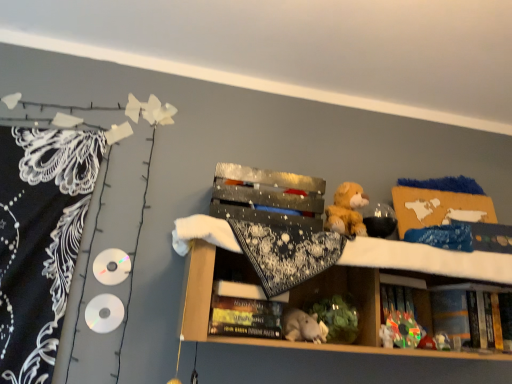
Question: Is shiny metallic box at center inside the boundaries of plush toy at center, which is the first toy from right to left, or outside?

Choices:
 (A) outside
 (B) inside

Answer: (A)

Question: In terms of height, does shiny metallic box at center look taller or shorter compared to plush toy at center, which is the first toy from right to left?

Choices:
 (A) short
 (B) tall

Answer: (B)

Question: Based on their relative distances, which object is nearer to the fuzzy yellow teddy bear at upper right, acting as the third toy starting from the bottom?

Choices:
 (A) hardcover book at center, the 2th book from the right
 (B) black lace blanket at left
 (C) plush toy at center, which is the 2th toy from top to bottom
 (D) hardcover book at lower right, which is the first book in back-to-front order
 (E) shiny metallic box at center

Answer: (E)

Question: Based on their relative distances, which object is farther from the gray plush toy at center?

Choices:
 (A) hardcover book at lower right, acting as the second book starting from the front
 (B) white plush toy at center, which ranks as the first toy in bottom-to-top order
 (C) plush toy at center, which is the 2th toy from top to bottom
 (D) shiny metallic box at center
 (E) black lace blanket at left

Answer: (E)